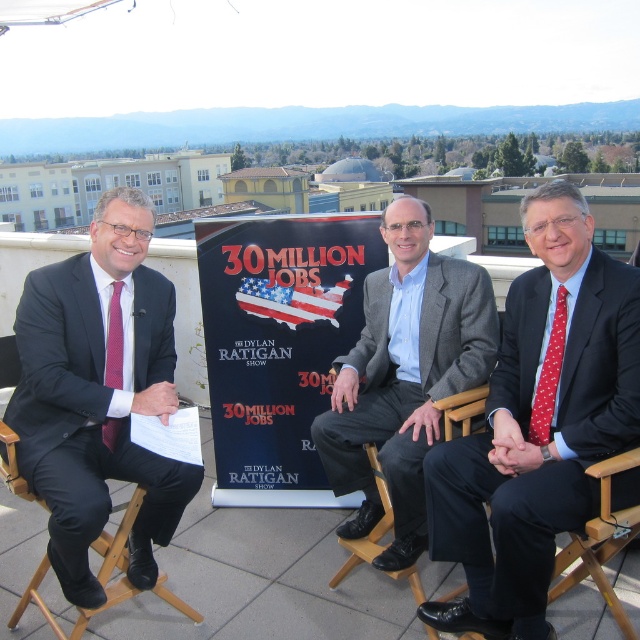
Question: Which object appears closest to the camera in this image?

Choices:
 (A) wooden at center
 (B) polished dark suit at center

Answer: (A)

Question: Which object is positioned closest to the wooden at center?

Choices:
 (A) matte black suit at left
 (B) blue fabric poster at center
 (C) maroon dotted tie at left

Answer: (B)

Question: Can you confirm if wooden at center is smaller than maroon dotted tie at left?

Choices:
 (A) yes
 (B) no

Answer: (B)

Question: Observing the image, what is the correct spatial positioning of polished dark suit at center in reference to wooden at center?

Choices:
 (A) above
 (B) below

Answer: (A)

Question: Does matte black suit at left come behind wooden at center?

Choices:
 (A) yes
 (B) no

Answer: (A)

Question: Which object appears farthest from the camera in this image?

Choices:
 (A) matte black suit at left
 (B) red dotted tie at right

Answer: (B)